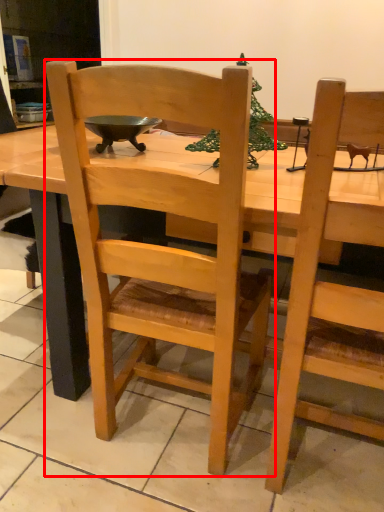
Question: Observing the image, what is the correct spatial positioning of chair (annotated by the red box) in reference to desk?

Choices:
 (A) right
 (B) left

Answer: (A)